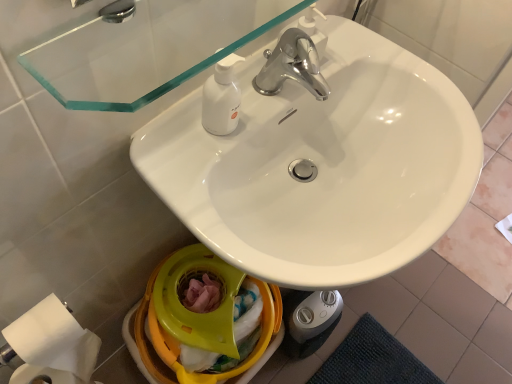
Identify the location of vacant area on top of yellow plastic bidet at lower center (from a real-world perspective). (195, 297).